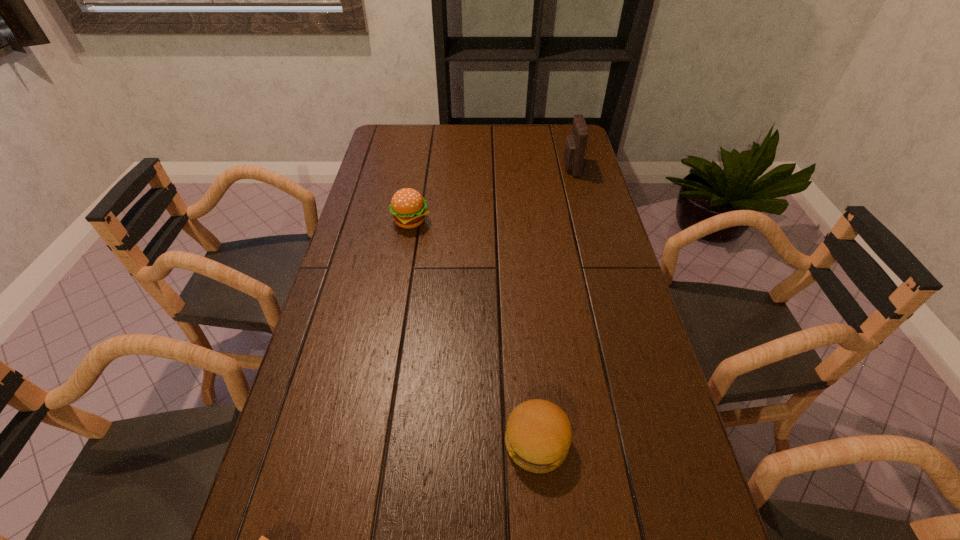
At what (x,y) coordinates should I click in order to perform the action: click on free space between the tallest object and the second object from right to left. Please return your answer as a coordinate pair (x, y). The width and height of the screenshot is (960, 540). Looking at the image, I should click on (554, 305).

This screenshot has width=960, height=540. Find the location of `blank region between the rightmost hamburger and the tallest object`. blank region between the rightmost hamburger and the tallest object is located at coordinates (554, 305).

This screenshot has width=960, height=540. What are the coordinates of `object identified as the third closest to the nearest hamburger` in the screenshot? It's located at (575, 144).

Identify which object is the third nearest to the second farthest object. Please provide its 2D coordinates. Your answer should be formatted as a tuple, i.e. [(x, y)], where the tuple contains the x and y coordinates of a point satisfying the conditions above.

[(262, 539)]

Identify which hamburger is the nearest to the third farthest object. Please provide its 2D coordinates. Your answer should be formatted as a tuple, i.e. [(x, y)], where the tuple contains the x and y coordinates of a point satisfying the conditions above.

[(262, 539)]

The width and height of the screenshot is (960, 540). What are the coordinates of `hamburger object that ranks as the second closest to the nearest hamburger` in the screenshot? It's located at (408, 207).